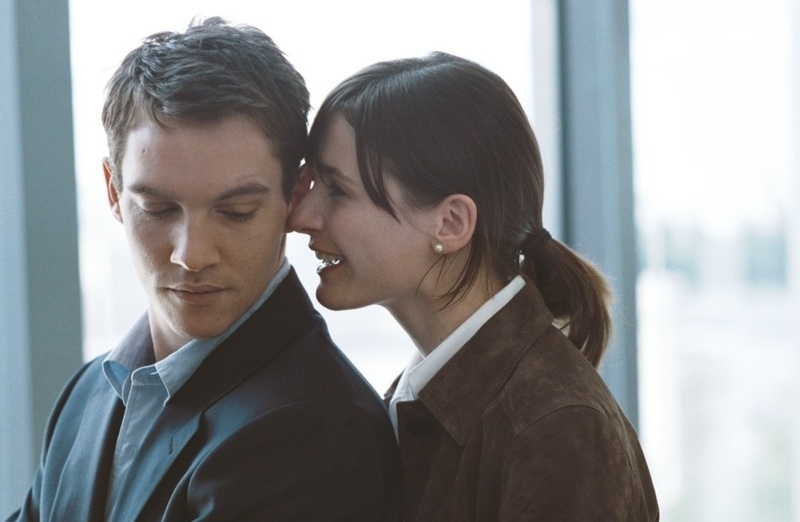
Image resolution: width=800 pixels, height=522 pixels. What are the coordinates of `blue wall` in the screenshot? It's located at (588, 211).